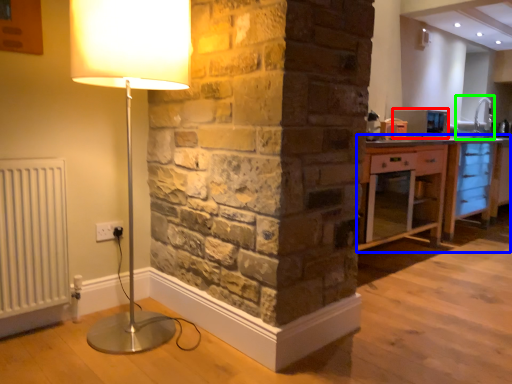
Question: Based on their relative distances, which object is farther from appliance (highlighted by a red box)? Choose from cabinetry (highlighted by a blue box) and sink (highlighted by a green box).

Choices:
 (A) cabinetry
 (B) sink

Answer: (B)